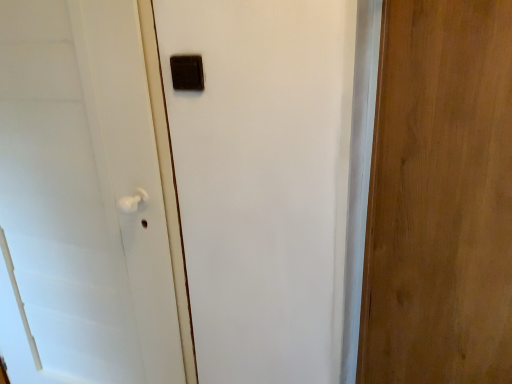
Question: Does white matte door handle at left, the second door in the right-to-left sequence, contain wooden door at right, which is the first door in right-to-left order?

Choices:
 (A) no
 (B) yes

Answer: (A)

Question: From a real-world perspective, is white matte door handle at left, the first door viewed from the left, over wooden door at right, the 2th door when ordered from left to right?

Choices:
 (A) yes
 (B) no

Answer: (B)

Question: Does white matte door handle at left, the second door in the right-to-left sequence, appear on the left side of wooden door at right, which is the first door in right-to-left order?

Choices:
 (A) yes
 (B) no

Answer: (A)

Question: Is white matte door handle at left, the first door viewed from the left, smaller than wooden door at right, the 2th door when ordered from left to right?

Choices:
 (A) no
 (B) yes

Answer: (A)

Question: Can you confirm if white matte door handle at left, the second door in the right-to-left sequence, is shorter than wooden door at right, the 2th door when ordered from left to right?

Choices:
 (A) no
 (B) yes

Answer: (A)

Question: Considering the positions of wooden door at right, the 2th door when ordered from left to right, and white matte door handle at left, the second door in the right-to-left sequence, in the image, is wooden door at right, the 2th door when ordered from left to right, wider or thinner than white matte door handle at left, the second door in the right-to-left sequence,?

Choices:
 (A) wide
 (B) thin

Answer: (B)

Question: From a real-world perspective, relative to white matte door handle at left, the first door viewed from the left, is wooden door at right, the 2th door when ordered from left to right, vertically above or below?

Choices:
 (A) above
 (B) below

Answer: (A)

Question: From their relative heights in the image, would you say wooden door at right, the 2th door when ordered from left to right, is taller or shorter than white matte door handle at left, the second door in the right-to-left sequence?

Choices:
 (A) short
 (B) tall

Answer: (A)

Question: Based on their sizes in the image, would you say wooden door at right, the 2th door when ordered from left to right, is bigger or smaller than white matte door handle at left, the first door viewed from the left?

Choices:
 (A) big
 (B) small

Answer: (B)

Question: Looking at their shapes, would you say white matte door handle at left, the second door in the right-to-left sequence, is wider or thinner than matte brown switch at upper center?

Choices:
 (A) wide
 (B) thin

Answer: (A)

Question: From the image's perspective, relative to matte brown switch at upper center, is white matte door handle at left, the second door in the right-to-left sequence, above or below?

Choices:
 (A) above
 (B) below

Answer: (B)

Question: Visually, is white matte door handle at left, the second door in the right-to-left sequence, positioned to the left or to the right of matte brown switch at upper center?

Choices:
 (A) right
 (B) left

Answer: (B)

Question: Does point (136, 294) appear closer or farther from the camera than point (170, 56)?

Choices:
 (A) farther
 (B) closer

Answer: (A)

Question: Relative to matte brown switch at upper center, is wooden door at right, the 2th door when ordered from left to right, in front or behind?

Choices:
 (A) front
 (B) behind

Answer: (A)

Question: Considering the relative positions of wooden door at right, the 2th door when ordered from left to right, and matte brown switch at upper center in the image provided, is wooden door at right, the 2th door when ordered from left to right, to the left or to the right of matte brown switch at upper center?

Choices:
 (A) left
 (B) right

Answer: (B)